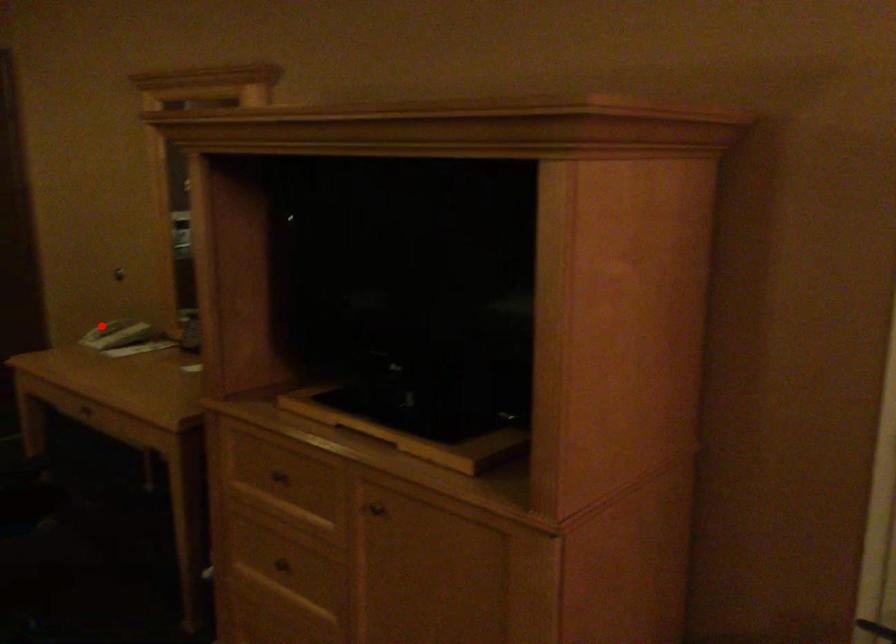
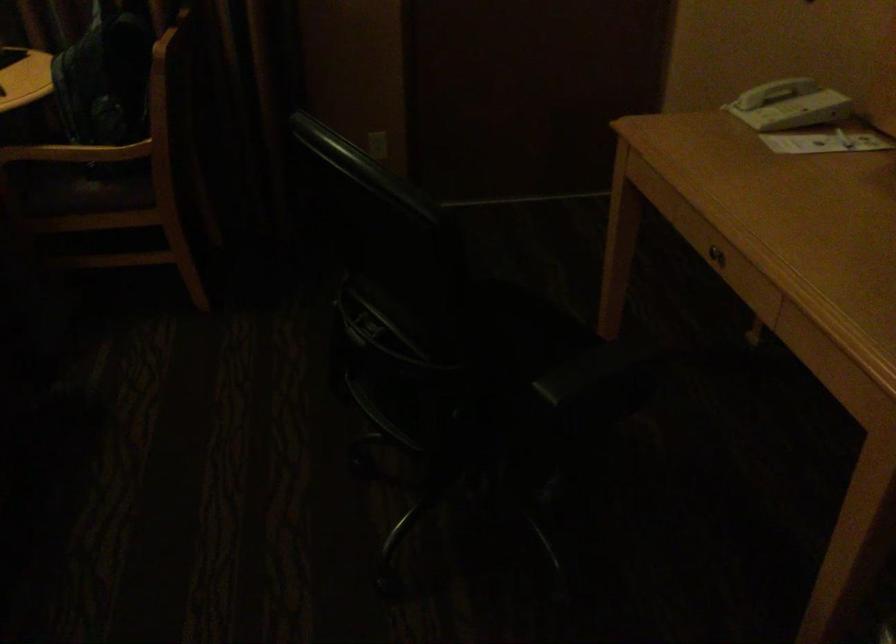
Question: A red point is marked in image1. In image2, is the corresponding 3D point closer to the camera or farther? Reply with the corresponding letter.

Choices:
 (A) The corresponding 3D point is closer.
 (B) The corresponding 3D point is farther.

Answer: (A)